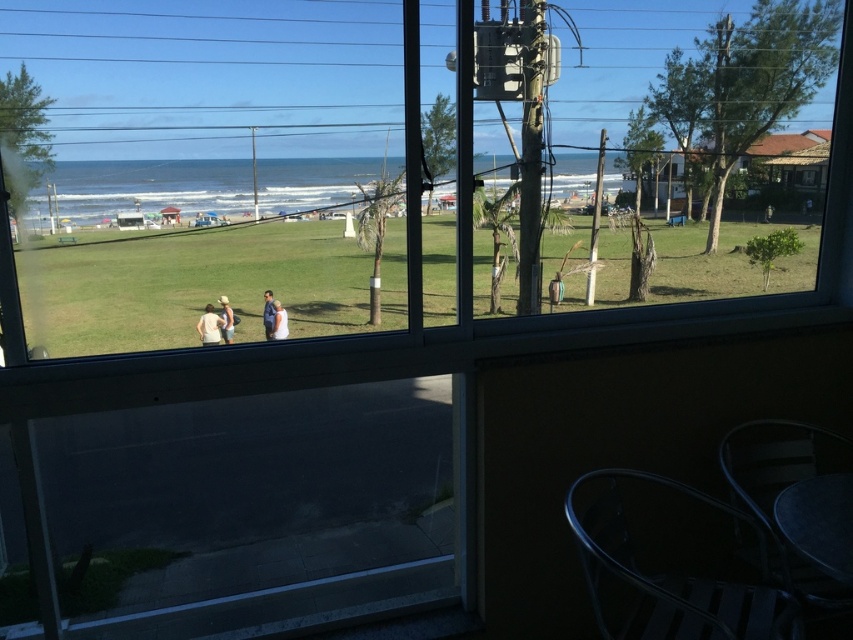
You are a photographer standing at the camera position. You want to take a photo of the green grassy field at center. Can you reach the field without moving the camera? Please explain.

The green grassy field at center and camera are 2.01 meters apart, so you cannot reach the field without moving the camera since it is too far away.

You are a customer sitting at the metal chair and table in the foreground. You see two people outside the window wearing a white cotton shirt at center and a blue fabric jacket at center. Which clothing item is positioned more to the left from your viewpoint?

The white cotton shirt at center is positioned more to the left compared to the blue fabric jacket at center from your viewpoint.

You are a tailor observing the clothing items displayed in the scene. You need to determine which clothing item is taller between the white cotton shirt at center and the blue fabric jacket at center. Which one is taller?

The white cotton shirt at center is taller than the blue fabric jacket at center according to the description.